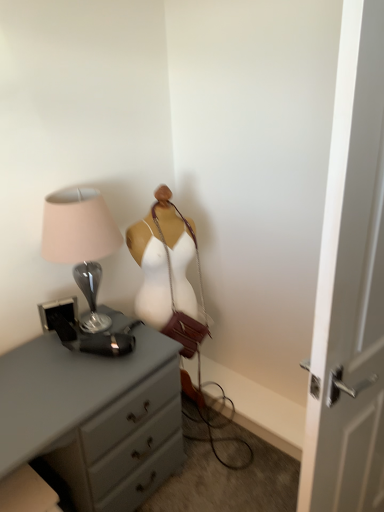
Question: From the image's perspective, is gray matte chest of drawers at left above or below white wooden door at right?

Choices:
 (A) below
 (B) above

Answer: (A)

Question: Is gray matte chest of drawers at left wider or thinner than white wooden door at right?

Choices:
 (A) thin
 (B) wide

Answer: (B)

Question: Which object is the closest to the white wooden door at right?

Choices:
 (A) white fabric mannequin at center
 (B) metallic glass lamp at left
 (C) gray matte chest of drawers at left

Answer: (C)

Question: Which of these objects is positioned closest to the gray matte chest of drawers at left?

Choices:
 (A) metallic glass lamp at left
 (B) white wooden door at right
 (C) white fabric mannequin at center

Answer: (A)